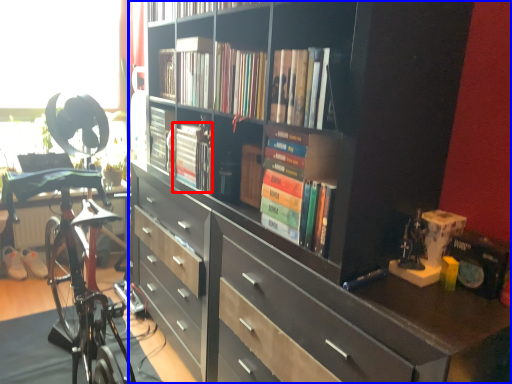
Question: Which object appears farthest to the camera in this image, book (highlighted by a red box) or bookcase (highlighted by a blue box)?

Choices:
 (A) book
 (B) bookcase

Answer: (A)